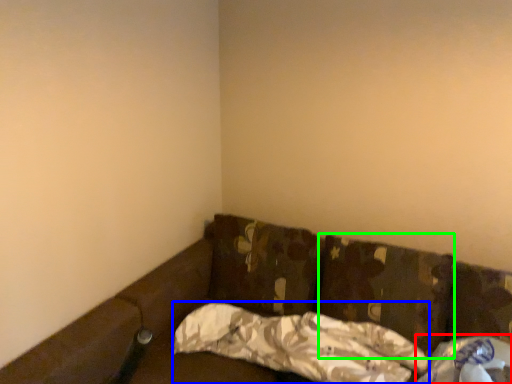
Question: Which object is positioned closest to material (highlighted by a red box)? Select from pillow (highlighted by a blue box) and pillow (highlighted by a green box).

Choices:
 (A) pillow
 (B) pillow

Answer: (B)